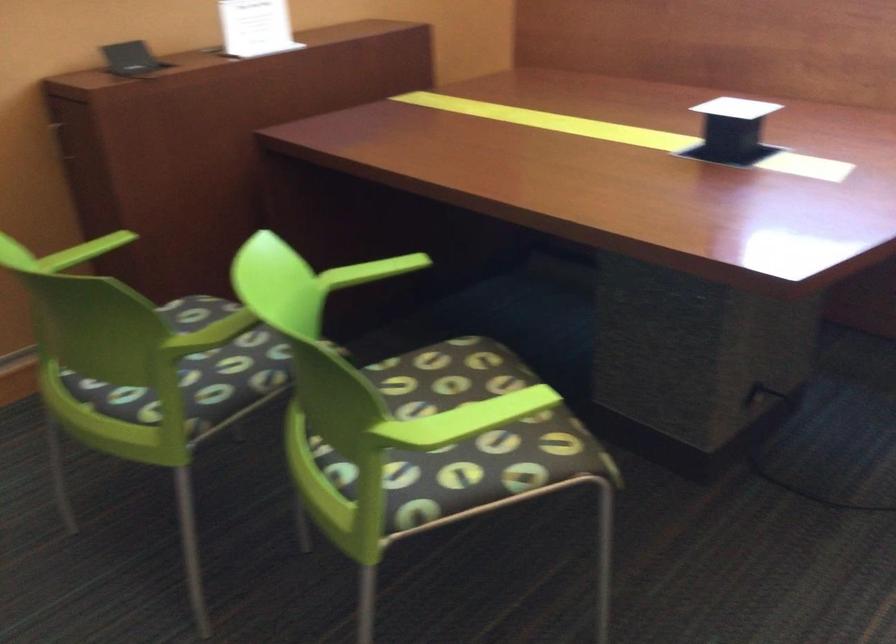
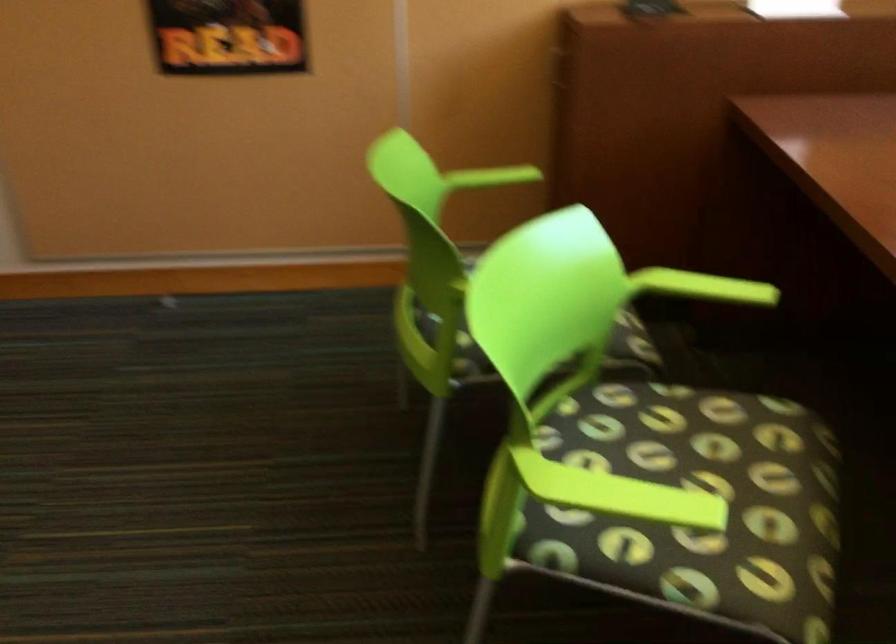
Question: How did the camera likely rotate?

Choices:
 (A) Left
 (B) Right
 (C) Up
 (D) Down

Answer: (A)